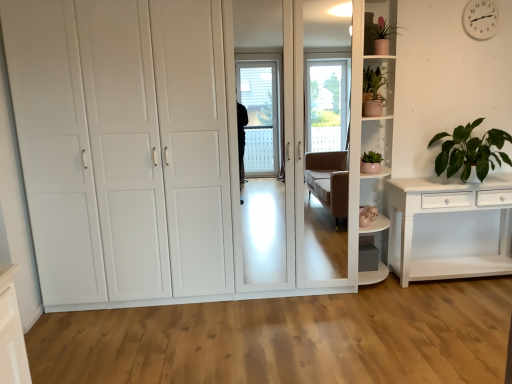
Identify the location of green matte plant at upper right, the 2th houseplant positioned from the right. Image resolution: width=512 pixels, height=384 pixels. (373, 92).

The image size is (512, 384). What do you see at coordinates (162, 157) in the screenshot?
I see `white glossy cupboard at center` at bounding box center [162, 157].

The height and width of the screenshot is (384, 512). What do you see at coordinates (371, 162) in the screenshot?
I see `matte pink pot at upper right, the 3th houseplant when ordered from right to left` at bounding box center [371, 162].

The image size is (512, 384). Describe the element at coordinates (378, 132) in the screenshot. I see `white glossy shelf at upper right, the first shelf positioned from the bottom` at that location.

Locate an element on the screen. The width and height of the screenshot is (512, 384). green matte plant at upper right, the 2th houseplant positioned from the right is located at coordinates (373, 92).

Is green leafy plant at right, the 3th houseplant viewed from the left, in contact with green matte plant at upper right, the second houseplant when ordered from left to right?

No, green leafy plant at right, the 3th houseplant viewed from the left, is not making contact with green matte plant at upper right, the second houseplant when ordered from left to right.

How many degrees apart are the facing directions of green leafy plant at right, marked as the first houseplant in a right-to-left arrangement, and green matte plant at upper right, the second houseplant when ordered from left to right?

19.1 degrees separate the facing orientations of green leafy plant at right, marked as the first houseplant in a right-to-left arrangement, and green matte plant at upper right, the second houseplant when ordered from left to right.

Which point is more forward, (497, 157) or (375, 101)?

The point (497, 157) is more forward.

Would you say green leafy plant at right, the 3th houseplant viewed from the left, is to the left or to the right of green matte plant at upper right, the second houseplant when ordered from left to right, in the picture?

Based on their positions, green leafy plant at right, the 3th houseplant viewed from the left, is located to the right of green matte plant at upper right, the second houseplant when ordered from left to right.

From the image's perspective, is matte pink pot at upper right, acting as the 1th houseplant starting from the left, above white glossy cupboard at center?

No.

Between matte pink pot at upper right, acting as the 1th houseplant starting from the left, and white glossy cupboard at center, which one appears on the right side from the viewer's perspective?

matte pink pot at upper right, acting as the 1th houseplant starting from the left, is more to the right.

How different are the orientations of matte pink pot at upper right, acting as the 1th houseplant starting from the left, and white glossy cupboard at center in degrees?

There is a 22.6-degree angle between the facing directions of matte pink pot at upper right, acting as the 1th houseplant starting from the left, and white glossy cupboard at center.

The height and width of the screenshot is (384, 512). I want to click on cupboard on the left of matte pink pot at upper right, the 3th houseplant when ordered from right to left, so click(162, 157).

Is white glossy cupboard at center to the right of green leafy plant at right, marked as the first houseplant in a right-to-left arrangement, from the viewer's perspective?

No.

Considering the sizes of white glossy cupboard at center and green leafy plant at right, marked as the first houseplant in a right-to-left arrangement, in the image, is white glossy cupboard at center wider or thinner than green leafy plant at right, marked as the first houseplant in a right-to-left arrangement,?

Clearly, white glossy cupboard at center has more width compared to green leafy plant at right, marked as the first houseplant in a right-to-left arrangement.

This screenshot has width=512, height=384. Find the location of `cupboard that appears below the green leafy plant at right, marked as the first houseplant in a right-to-left arrangement (from the image's perspective)`. cupboard that appears below the green leafy plant at right, marked as the first houseplant in a right-to-left arrangement (from the image's perspective) is located at coordinates (162, 157).

Is white glossy cupboard at center directly adjacent to green leafy plant at right, the 3th houseplant viewed from the left?

No, white glossy cupboard at center is not next to green leafy plant at right, the 3th houseplant viewed from the left.

Is white glossy cupboard at center placed right next to white glossy shelf at upper right, which is counted as the 2th shelf, starting from the top?

There is a gap between white glossy cupboard at center and white glossy shelf at upper right, which is counted as the 2th shelf, starting from the top.

Can you confirm if white glossy cupboard at center is thinner than white glossy shelf at upper right, the first shelf positioned from the bottom?

No, white glossy cupboard at center is not thinner than white glossy shelf at upper right, the first shelf positioned from the bottom.

Which object is more forward, white glossy cupboard at center or matte pink pot at upper right, which appears as the second shelf when ordered from the bottom?

Positioned in front is white glossy cupboard at center.

Between point (23, 95) and point (371, 27), which one is positioned behind?

Positioned behind is point (371, 27).

Is white glossy cupboard at center smaller than matte pink pot at upper right, acting as the 1th shelf starting from the top?

No.

From a real-world perspective, is white glossy cupboard at center below matte pink pot at upper right, acting as the 1th shelf starting from the top?

Yes, from a real-world perspective, white glossy cupboard at center is beneath matte pink pot at upper right, acting as the 1th shelf starting from the top.

Is white plastic clock at upper right far away from matte pink pot at upper right, acting as the 1th houseplant starting from the left?

Yes, white plastic clock at upper right and matte pink pot at upper right, acting as the 1th houseplant starting from the left, are quite far apart.

What's the angular difference between white plastic clock at upper right and matte pink pot at upper right, acting as the 1th houseplant starting from the left,'s facing directions?

The angular difference between white plastic clock at upper right and matte pink pot at upper right, acting as the 1th houseplant starting from the left, is 24.7 degrees.

Does white plastic clock at upper right come in front of matte pink pot at upper right, the 3th houseplant when ordered from right to left?

No, it is behind matte pink pot at upper right, the 3th houseplant when ordered from right to left.

Is white glossy cupboard at center spatially inside matte pink pot at upper right, acting as the 1th houseplant starting from the left, or outside of it?

white glossy cupboard at center is not enclosed by matte pink pot at upper right, acting as the 1th houseplant starting from the left.

Which object is positioned more to the right, white glossy cupboard at center or matte pink pot at upper right, the 3th houseplant when ordered from right to left?

Positioned to the right is matte pink pot at upper right, the 3th houseplant when ordered from right to left.

Are white glossy cupboard at center and matte pink pot at upper right, acting as the 1th houseplant starting from the left, far apart?

Yes, white glossy cupboard at center and matte pink pot at upper right, acting as the 1th houseplant starting from the left, are quite far apart.

There is a green matte plant at upper right, the 2th houseplant positioned from the right. Find the location of `the 1st houseplant below it (from a real-world perspective)`. the 1st houseplant below it (from a real-world perspective) is located at coordinates (470, 151).

In order to click on cupboard that is above the matte pink pot at upper right, the 3th houseplant when ordered from right to left (from the image's perspective) in this screenshot , I will do `click(162, 157)`.

Considering their positions, is matte pink pot at upper right, which appears as the second shelf when ordered from the bottom, positioned closer to white glossy shelf at upper right, which is counted as the 2th shelf, starting from the top, than white glossy cupboard at center?

Based on the image, matte pink pot at upper right, which appears as the second shelf when ordered from the bottom, appears to be nearer to white glossy shelf at upper right, which is counted as the 2th shelf, starting from the top.

From the image, which object appears to be nearer to green leafy plant at right, the 3th houseplant viewed from the left, white glossy shelf at upper right, which is counted as the 2th shelf, starting from the top, or matte pink pot at upper right, which appears as the second shelf when ordered from the bottom?

Among the two, white glossy shelf at upper right, which is counted as the 2th shelf, starting from the top, is located nearer to green leafy plant at right, the 3th houseplant viewed from the left.

Based on their spatial positions, is matte pink pot at upper right, acting as the 1th houseplant starting from the left, or green matte plant at upper right, the 2th houseplant positioned from the right, closer to white glossy shelf at upper right, the first shelf positioned from the bottom?

Based on the image, green matte plant at upper right, the 2th houseplant positioned from the right, appears to be nearer to white glossy shelf at upper right, the first shelf positioned from the bottom.

Looking at the image, which one is located closer to white glossy cupboard at center, green leafy plant at right, the 3th houseplant viewed from the left, or white plastic clock at upper right?

green leafy plant at right, the 3th houseplant viewed from the left, is positioned closer to the anchor white glossy cupboard at center.

Estimate the real-world distances between objects in this image. Which object is further from white glossy shelf at upper right, which is counted as the 2th shelf, starting from the top, green matte plant at upper right, the second houseplant when ordered from left to right, or white glossy cupboard at center?

white glossy cupboard at center is further to white glossy shelf at upper right, which is counted as the 2th shelf, starting from the top.

Estimate the real-world distances between objects in this image. Which object is closer to matte pink pot at upper right, acting as the 1th houseplant starting from the left, white plastic clock at upper right or white glossy cupboard at center?

white plastic clock at upper right.

Considering their positions, is green matte plant at upper right, the 2th houseplant positioned from the right, positioned further to white plastic clock at upper right than white glossy shelf at upper right, the first shelf positioned from the bottom?

white glossy shelf at upper right, the first shelf positioned from the bottom.

Estimate the real-world distances between objects in this image. Which object is further from green leafy plant at right, the 3th houseplant viewed from the left, green matte plant at upper right, the 2th houseplant positioned from the right, or white glossy cupboard at center?

white glossy cupboard at center.

Identify the location of shelf situated between green matte plant at upper right, the 2th houseplant positioned from the right, and green leafy plant at right, the 3th houseplant viewed from the left, from left to right. click(378, 132).

The image size is (512, 384). I want to click on houseplant between white plastic clock at upper right and green leafy plant at right, the 3th houseplant viewed from the left, in the vertical direction, so [373, 92].

You are a GUI agent. You are given a task and a screenshot of the screen. Output one action in this format:
    pyautogui.click(x=<x>, y=<y>)
    Task: Click on the shelf between white plastic clock at upper right and white glossy shelf at upper right, the first shelf positioned from the bottom, vertically
    Image resolution: width=512 pixels, height=384 pixels.
    Given the screenshot: What is the action you would take?
    pyautogui.click(x=379, y=24)

This screenshot has height=384, width=512. I want to click on shelf situated between white glossy cupboard at center and green matte plant at upper right, the 2th houseplant positioned from the right, from left to right, so pyautogui.click(x=379, y=24).